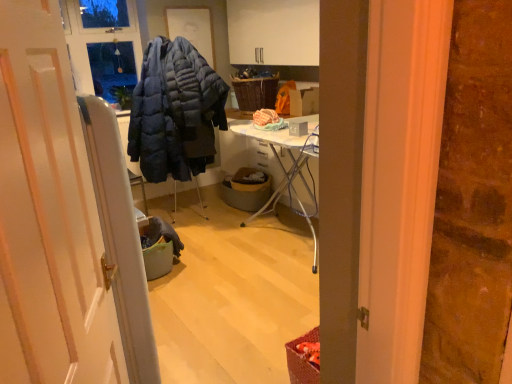
The height and width of the screenshot is (384, 512). I want to click on free location to the left of brown woven basket at center, so click(207, 209).